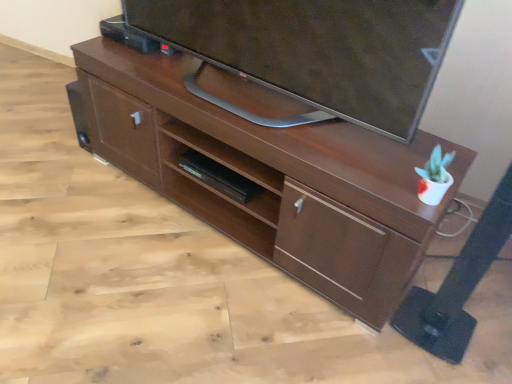
Find the location of `vacant space underneath matte black tv at upper center (from a real-world perspective)`. vacant space underneath matte black tv at upper center (from a real-world perspective) is located at coordinates (246, 97).